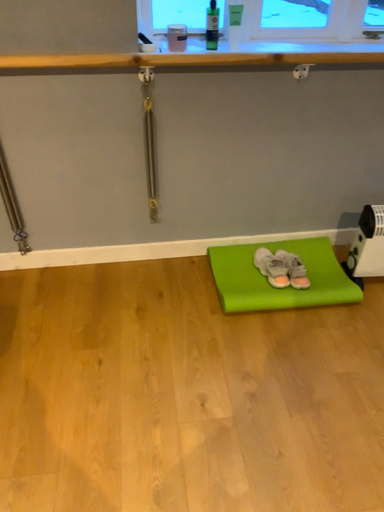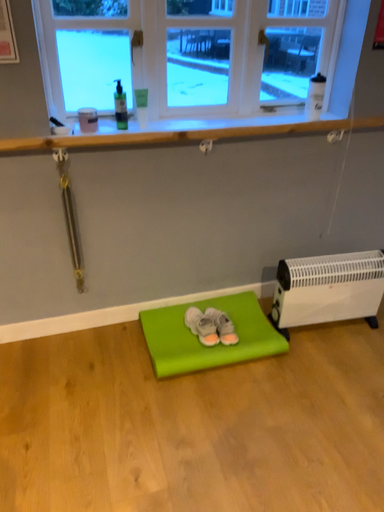
Question: How did the camera likely rotate when shooting the video?

Choices:
 (A) rotated upward
 (B) rotated downward

Answer: (A)